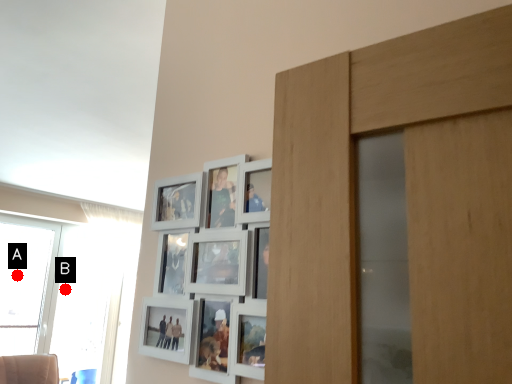
Question: Two points are circled on the image, labeled by A and B beside each circle. Which point is farther to the camera?

Choices:
 (A) A is further
 (B) B is further

Answer: (B)